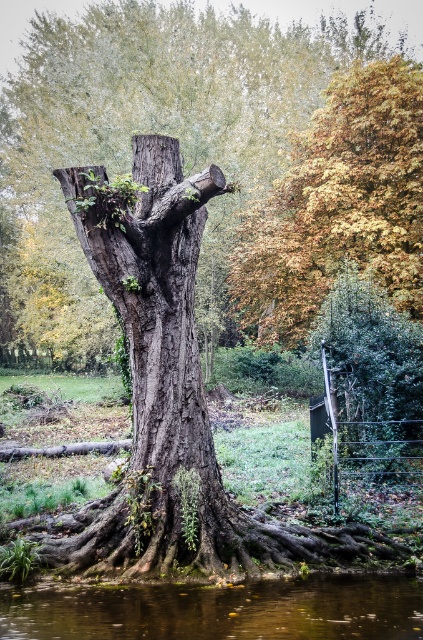
Does gray rough bark tree trunk at center have a greater height compared to yellow-green foliage at upper right?

Yes.

Which is more to the left, gray rough bark tree trunk at center or yellow-green foliage at upper right?

Positioned to the left is gray rough bark tree trunk at center.

This screenshot has width=423, height=640. I want to click on gray rough bark tree trunk at center, so click(x=147, y=131).

Where is `gray rough bark tree trunk at center`? The height and width of the screenshot is (640, 423). gray rough bark tree trunk at center is located at coordinates (147, 131).

Based on the photo, can you confirm if gray rough bark tree trunk at center is positioned to the left of brown reflective water at lower center?

Indeed, gray rough bark tree trunk at center is positioned on the left side of brown reflective water at lower center.

Which is more to the left, gray rough bark tree trunk at center or brown reflective water at lower center?

From the viewer's perspective, gray rough bark tree trunk at center appears more on the left side.

Image resolution: width=423 pixels, height=640 pixels. In order to click on gray rough bark tree trunk at center in this screenshot , I will do `click(147, 131)`.

Can you confirm if yellow-green foliage at upper right is shorter than brown reflective water at lower center?

No, yellow-green foliage at upper right is not shorter than brown reflective water at lower center.

Looking at this image, who is more forward, (371,241) or (41,589)?

Point (41,589)

The height and width of the screenshot is (640, 423). What do you see at coordinates (338, 205) in the screenshot?
I see `yellow-green foliage at upper right` at bounding box center [338, 205].

Identify the location of yellow-green foliage at upper right. (338, 205).